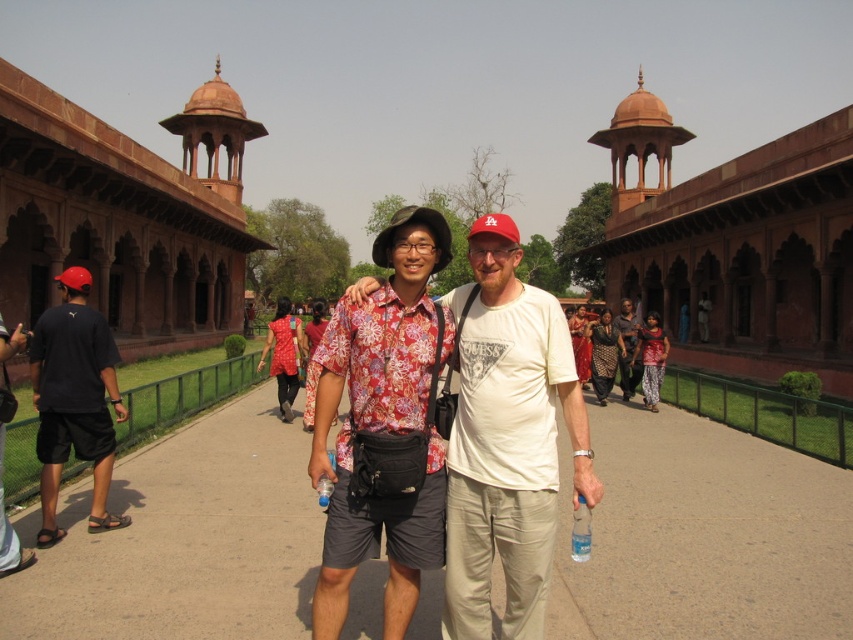
Question: Estimate the real-world distances between objects in this image. Which object is farther from the floral fabric shirt at center?

Choices:
 (A) satin red sari at center
 (B) red cotton dress at center
 (C) reddish-brown stone palace at center
 (D) reddish-brown stone palace at left

Answer: (C)

Question: Can you confirm if printed fabric dress at center is positioned above satin red sari at center?

Choices:
 (A) no
 (B) yes

Answer: (A)

Question: Which point appears farthest from the camera in this image?

Choices:
 (A) (628, 381)
 (B) (585, 333)
 (C) (601, 356)
 (D) (793, 560)

Answer: (B)

Question: Does floral fabric shirt at center lie behind black fabric shorts at left?

Choices:
 (A) yes
 (B) no

Answer: (B)

Question: Is gray concrete pavement at center to the right of red silk sari at center from the viewer's perspective?

Choices:
 (A) no
 (B) yes

Answer: (A)

Question: Which object is positioned farthest from the dark brown textured pants at center?

Choices:
 (A) black fabric shorts at left
 (B) printed fabric dress at center
 (C) red cotton dress at center
 (D) red silk sari at center

Answer: (A)